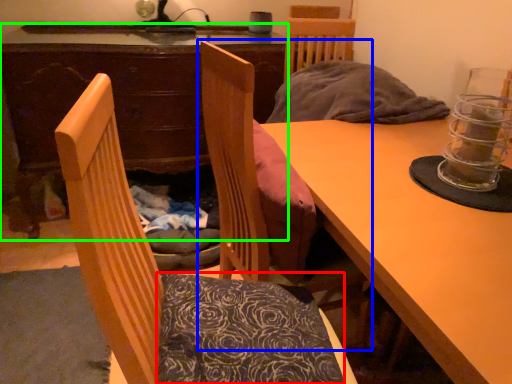
Question: Which is farther away from pillow (highlighted by a red box)? chair (highlighted by a blue box) or desk (highlighted by a green box)?

Choices:
 (A) chair
 (B) desk

Answer: (B)